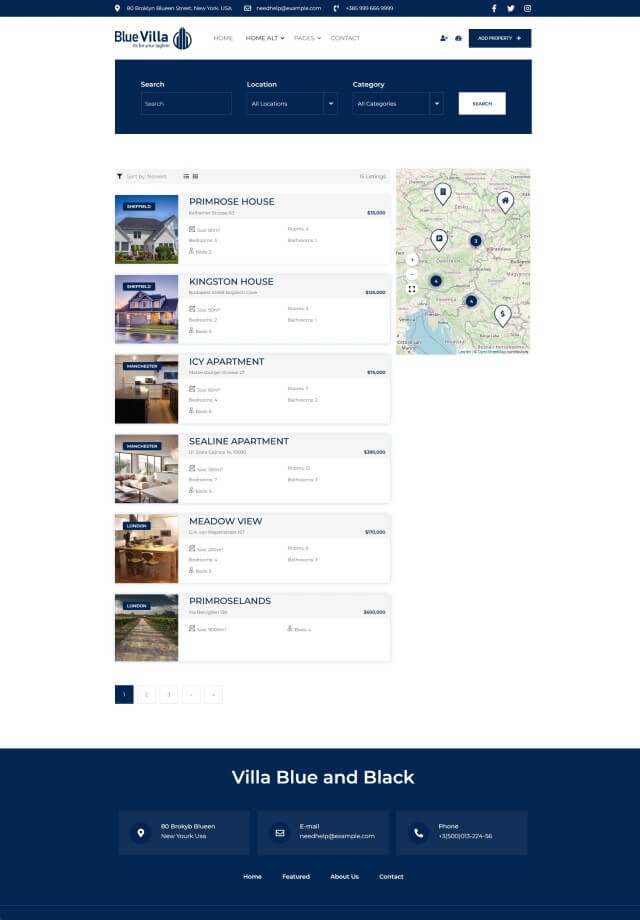
Find the location of `thumbnail picture of inside apartment kitchen`. thumbnail picture of inside apartment kitchen is located at coordinates (x=155, y=397).